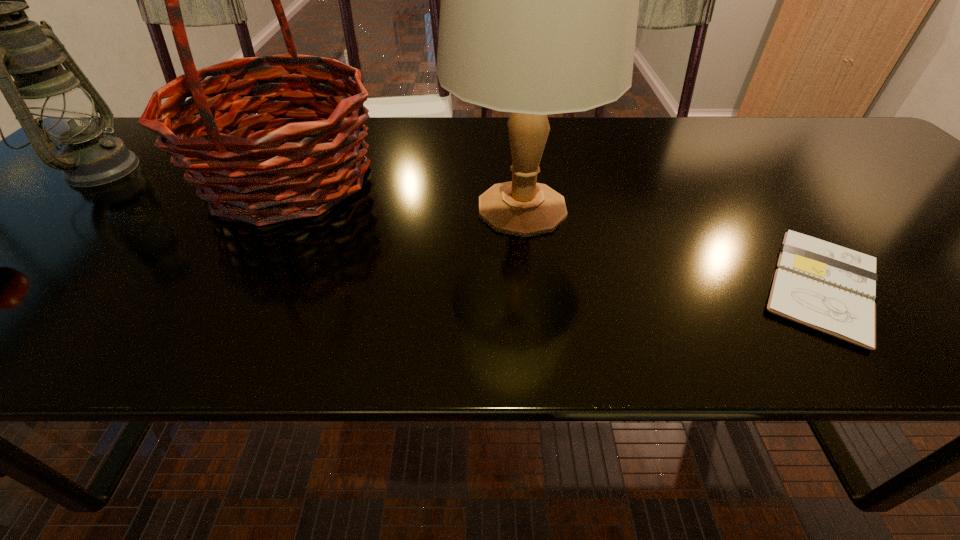
Find the location of `basket present at the far edge`. basket present at the far edge is located at coordinates (236, 172).

At what (x,y) coordinates should I click in order to perform the action: click on oil lamp located in the far edge section of the desktop. Please return your answer as a coordinate pair (x, y). The height and width of the screenshot is (540, 960). Looking at the image, I should click on (46, 99).

This screenshot has width=960, height=540. What are the coordinates of `object at the near edge` in the screenshot? It's located at (827, 287).

At what (x,y) coordinates should I click in order to perform the action: click on object that is at the left edge. Please return your answer as a coordinate pair (x, y). Looking at the image, I should click on (46, 99).

Find the location of a particular element. object at the far left corner is located at coordinates 46,99.

Where is `vacant space at the far edge`? The width and height of the screenshot is (960, 540). vacant space at the far edge is located at coordinates (458, 150).

This screenshot has width=960, height=540. In the image, there is a desktop. In order to click on free space at the near edge in this screenshot , I will do `click(656, 324)`.

Where is `free space at the right edge`? The width and height of the screenshot is (960, 540). free space at the right edge is located at coordinates (948, 235).

Identify the location of blank space at the far left corner of the desktop. The width and height of the screenshot is (960, 540). (128, 119).

In order to click on free space at the far right corner of the desktop in this screenshot , I will do `click(822, 157)`.